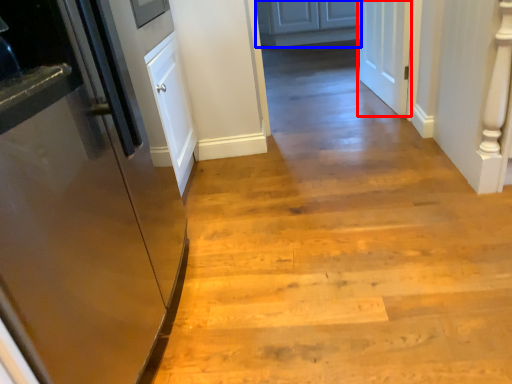
Question: Which object is closer to the camera taking this photo, door (highlighted by a red box) or cabinetry (highlighted by a blue box)?

Choices:
 (A) door
 (B) cabinetry

Answer: (A)